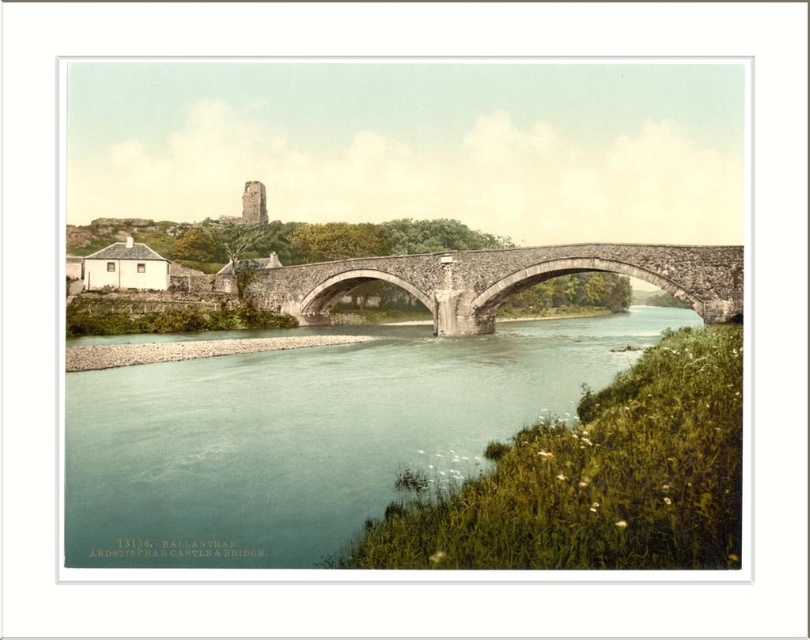
Between greenish-blue water at center and stone bridge at center, which one has more height?

Standing taller between the two is greenish-blue water at center.

Between greenish-blue water at center and stone bridge at center, which one is positioned higher?

Positioned higher is stone bridge at center.

Identify the location of greenish-blue water at center. (310, 435).

At what (x,y) coordinates should I click in order to perform the action: click on greenish-blue water at center. Please return your answer as a coordinate pair (x, y). Looking at the image, I should click on point(310,435).